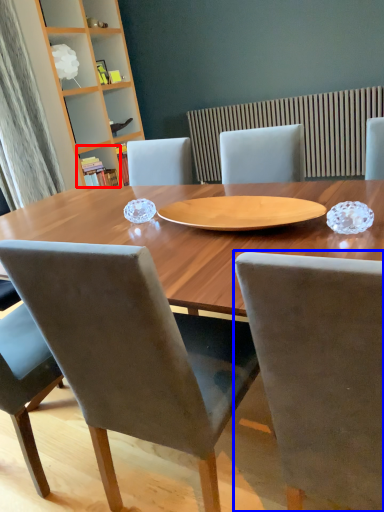
Question: Which object is closer to the camera taking this photo, shelf (highlighted by a red box) or chair (highlighted by a blue box)?

Choices:
 (A) shelf
 (B) chair

Answer: (B)